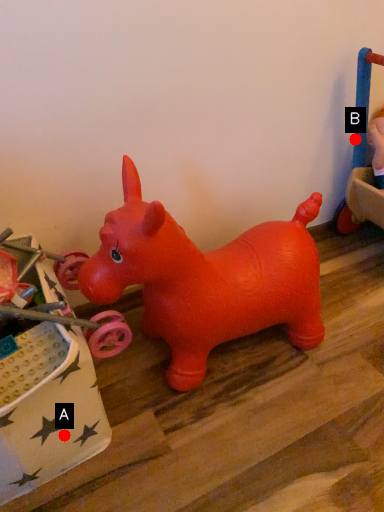
Question: Two points are circled on the image, labeled by A and B beside each circle. Which point is farther from the camera taking this photo?

Choices:
 (A) A is further
 (B) B is further

Answer: (B)